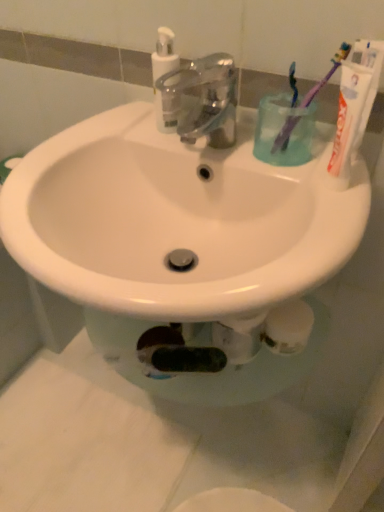
Find the location of a particular element. vacant space in front of translucent plastic cup at upper right is located at coordinates (315, 205).